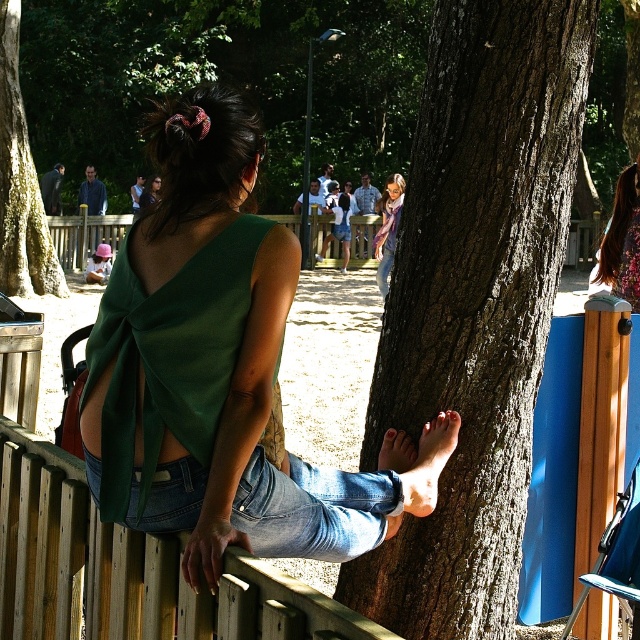
Is smooth brown tree trunk at left above light brown hair at upper center?

Yes.

Is smooth brown tree trunk at left positioned before light brown hair at upper center?

Yes, smooth brown tree trunk at left is closer to the viewer.

Is point (54, 266) positioned in front of point (384, 234)?

Yes, point (54, 266) is closer to viewer.

Image resolution: width=640 pixels, height=640 pixels. I want to click on smooth brown tree trunk at left, so click(20, 182).

Who is more distant from viewer, (180, 246) or (611, 269)?

The point (611, 269) is behind.

Can you confirm if green fabric top at center is wider than shiny brown hair at upper right?

Indeed, green fabric top at center has a greater width compared to shiny brown hair at upper right.

Between point (156, 243) and point (636, 266), which one is positioned in front?

Point (156, 243)

Locate an element on the screen. The height and width of the screenshot is (640, 640). green fabric top at center is located at coordinates (221, 371).

Is jeans at lower center to the right of shiny brown hair at upper right from the viewer's perspective?

Incorrect, jeans at lower center is not on the right side of shiny brown hair at upper right.

Who is more distant from viewer, (308, 547) or (612, 227)?

Positioned behind is point (612, 227).

Which is in front, point (184, 470) or point (628, 196)?

Point (184, 470)

At what (x,y) coordinates should I click in order to perform the action: click on jeans at lower center. Please return your answer as a coordinate pair (x, y). This screenshot has width=640, height=640. Looking at the image, I should click on (310, 509).